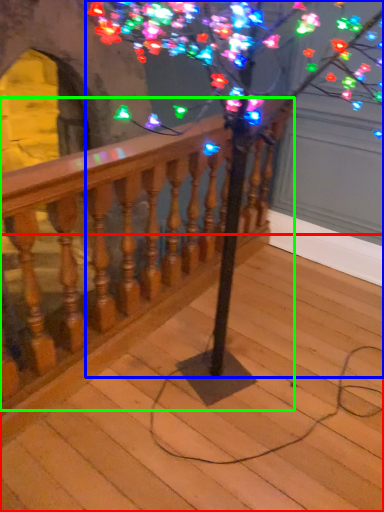
Question: Considering the real-world distances, which object is farthest from stairs (highlighted by a red box)? tree (highlighted by a blue box) or rail (highlighted by a green box)?

Choices:
 (A) tree
 (B) rail

Answer: (A)